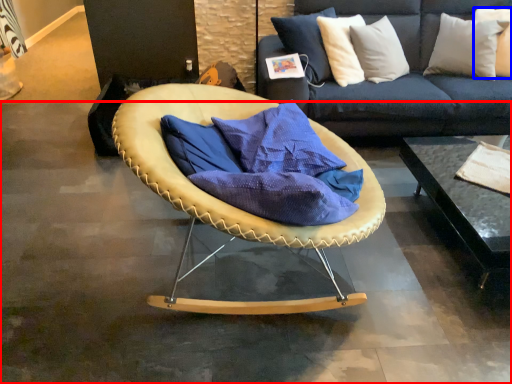
Question: Which point is closer to the camera, concrete (highlighted by a red box) or pillow (highlighted by a blue box)?

Choices:
 (A) concrete
 (B) pillow

Answer: (A)